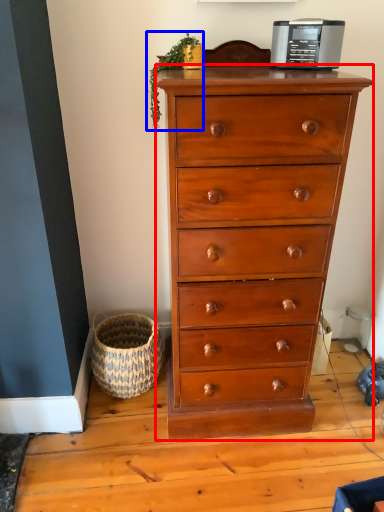
Question: Which object appears closest to the camera in this image, chest of drawers (highlighted by a red box) or plant (highlighted by a blue box)?

Choices:
 (A) chest of drawers
 (B) plant

Answer: (A)